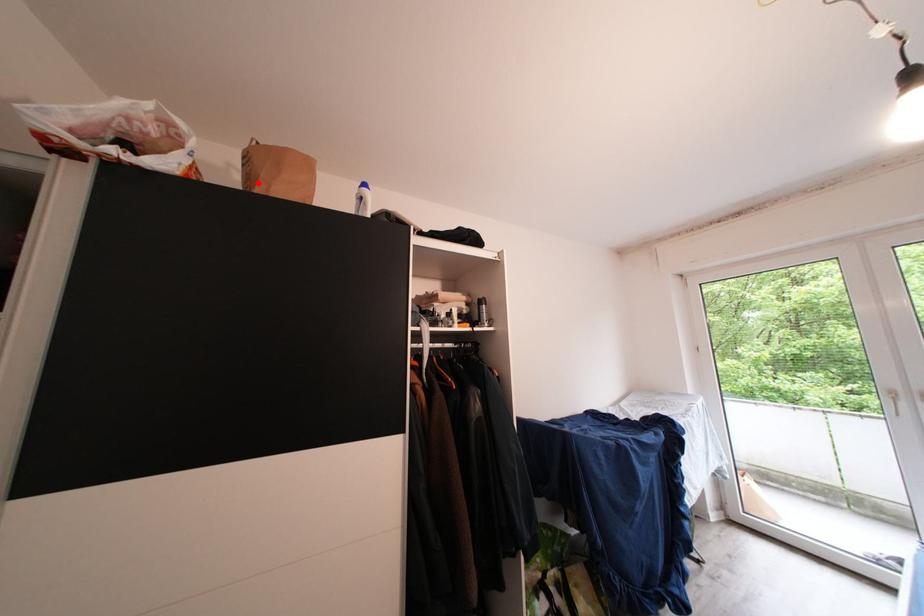
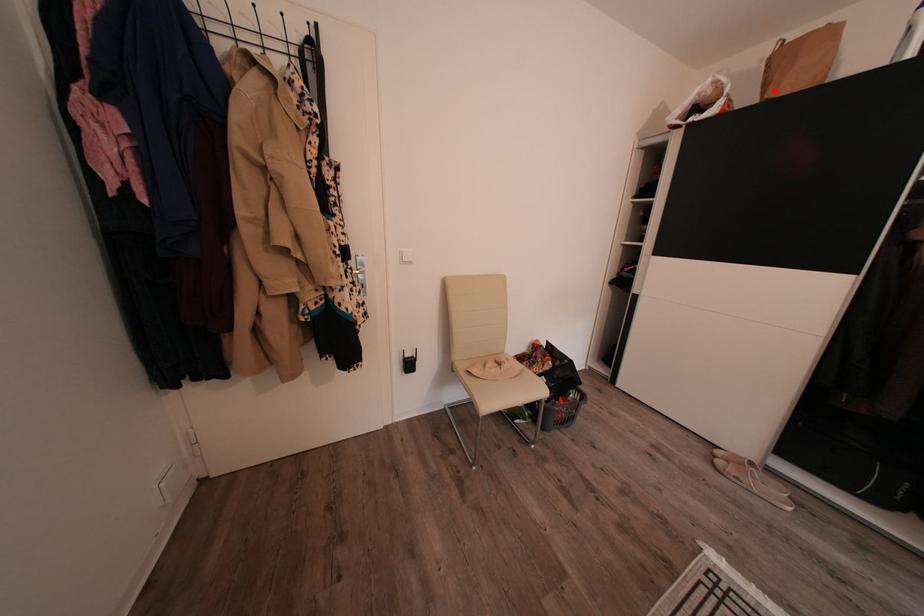
I am providing you with two images of the same scene from different viewpoints. A red point is marked on the first image and another point is marked on the second image. Is the red point in image1 aligned with the point shown in image2?

Yes